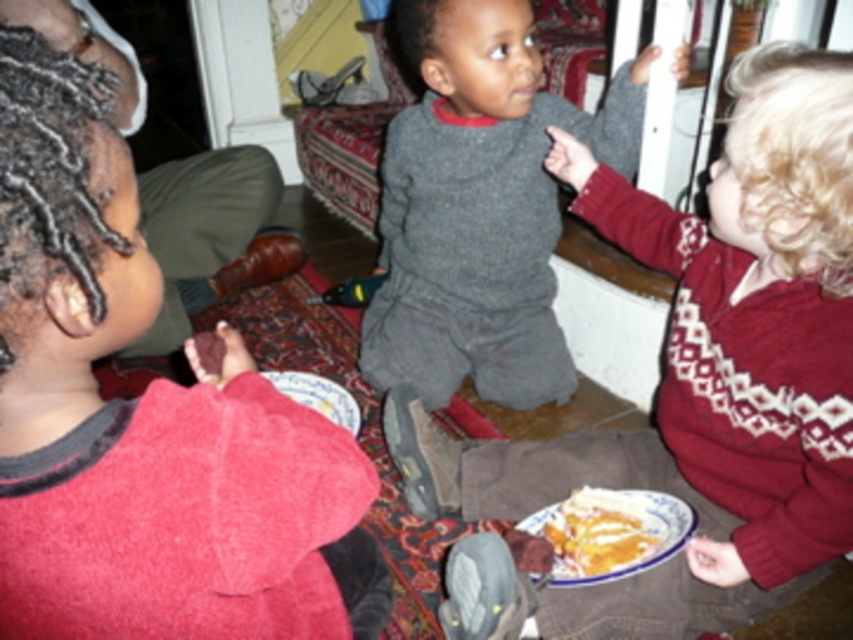
Does red fleece sweater at left appear over yellowish matte pie at lower center?

Yes, red fleece sweater at left is above yellowish matte pie at lower center.

In the scene shown: Can you confirm if red fleece sweater at left is thinner than yellowish matte pie at lower center?

In fact, red fleece sweater at left might be wider than yellowish matte pie at lower center.

What do you see at coordinates (140, 416) in the screenshot?
I see `red fleece sweater at left` at bounding box center [140, 416].

I want to click on red fleece sweater at left, so click(140, 416).

Can you confirm if red fleece sweater at left is positioned above matte red sweater at left?

No.

Consider the image. Is red fleece sweater at left smaller than matte red sweater at left?

Indeed, red fleece sweater at left has a smaller size compared to matte red sweater at left.

Which is in front, point (91, 596) or point (125, 49)?

Point (91, 596) is more forward.

The height and width of the screenshot is (640, 853). Identify the location of red fleece sweater at left. point(140,416).

Does gray wool sweater at center come in front of white ceramic plate at lower center?

No, it is behind white ceramic plate at lower center.

Between gray wool sweater at center and white ceramic plate at lower center, which one is positioned lower?

Positioned lower is white ceramic plate at lower center.

Between point (538, 170) and point (357, 412), which one is positioned in front?

Point (357, 412) is more forward.

You are a GUI agent. You are given a task and a screenshot of the screen. Output one action in this format:
    pyautogui.click(x=<x>, y=<y>)
    Task: Click on the gray wool sweater at center
    Image resolution: width=853 pixels, height=640 pixels.
    Given the screenshot: What is the action you would take?
    pyautogui.click(x=480, y=205)